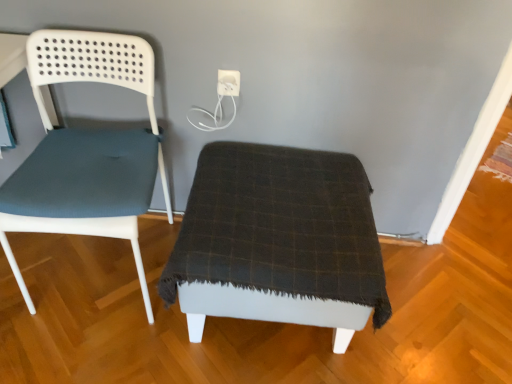
Where is `free space to the right of dark plaid fabric ottoman at center`? free space to the right of dark plaid fabric ottoman at center is located at coordinates (436, 313).